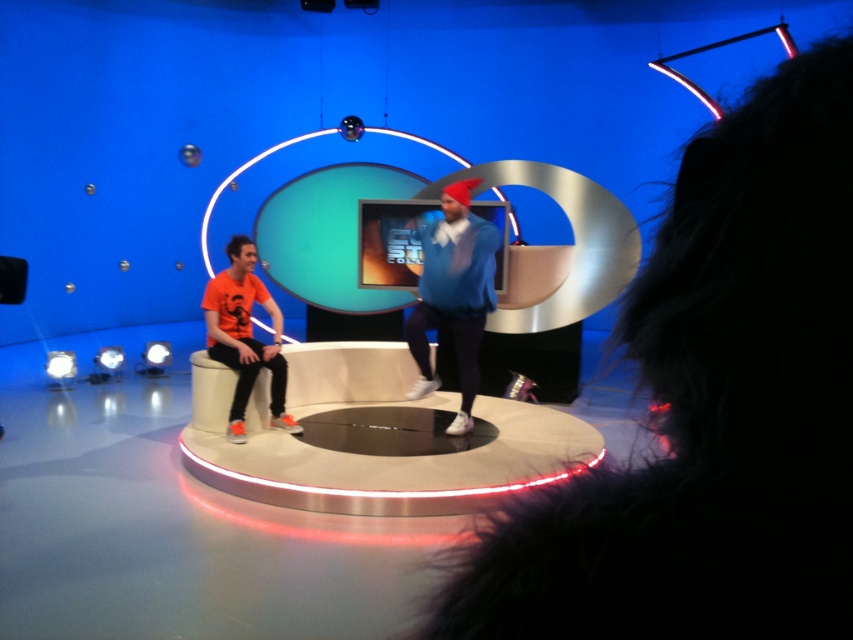
Is point (483, 314) in front of point (225, 340)?

That is True.

The height and width of the screenshot is (640, 853). Identify the location of blue fleece jacket at center. (453, 292).

Between point (422, 310) and point (279, 339), which one is positioned behind?

Positioned behind is point (279, 339).

You are a GUI agent. You are given a task and a screenshot of the screen. Output one action in this format:
    pyautogui.click(x=<x>, y=<y>)
    Task: Click on the blue fleece jacket at center
    This screenshot has width=853, height=640.
    Given the screenshot: What is the action you would take?
    pyautogui.click(x=453, y=292)